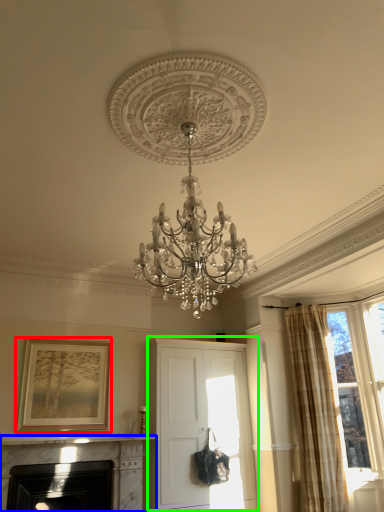
Question: Which object is the closest to the picture frame (highlighted by a red box)? Choose among these: fireplace (highlighted by a blue box) or cabinetry (highlighted by a green box).

Choices:
 (A) fireplace
 (B) cabinetry

Answer: (A)